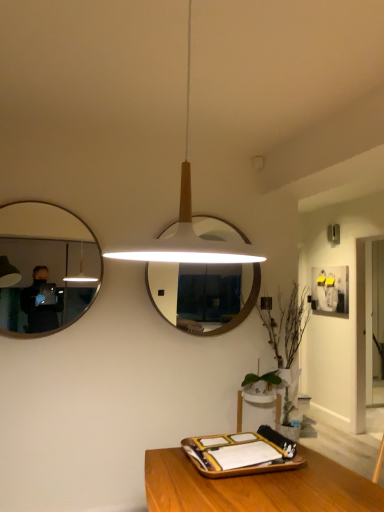
Question: Looking at their shapes, would you say white matte pendant light at center is wider or thinner than green leafy plant at lower right?

Choices:
 (A) thin
 (B) wide

Answer: (B)

Question: Does point 231,259 appear closer or farther from the camera than point 291,340?

Choices:
 (A) closer
 (B) farther

Answer: (A)

Question: Which is farther from the matte black mirror at left, which is the 1th mirror from left to right?

Choices:
 (A) matte white picture frame at upper right
 (B) wooden tray at lower center
 (C) white wooden mirror at center, which is the 1th mirror from back to front
 (D) white matte pendant light at center
 (E) green leafy plant at lower right

Answer: (A)

Question: Which is farther from the matte black mirror at left, which is the 1th mirror from left to right?

Choices:
 (A) matte white picture frame at upper right
 (B) green leafy plant at lower right
 (C) wooden tray at lower center
 (D) white wooden mirror at center, which is the first mirror in right-to-left order
 (E) white matte pendant light at center

Answer: (A)